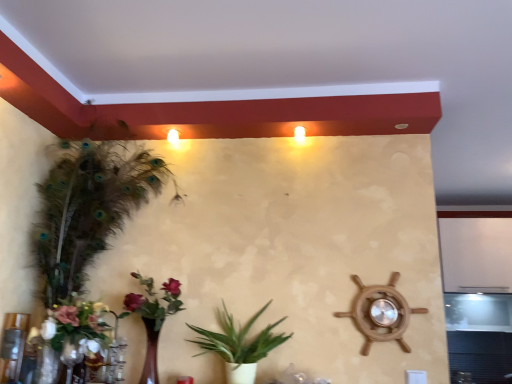
Question: Should I look upward or downward to see white matte floral arrangement at lower left, marked as the 2th floral arrangement in a right-to-left arrangement?

Choices:
 (A) down
 (B) up

Answer: (A)

Question: Should I look upward or downward to see matte wooden vase with flowers at lower left, the 2th floral arrangement in the left-to-right sequence?

Choices:
 (A) down
 (B) up

Answer: (A)

Question: Is white matte floral arrangement at lower left, marked as the 2th floral arrangement in a right-to-left arrangement, facing towards green feathered houseplant at left, which is counted as the 1th houseplant, starting from the left?

Choices:
 (A) no
 (B) yes

Answer: (B)

Question: Is white matte floral arrangement at lower left, the first floral arrangement viewed from the left, taller than green feathered houseplant at left, which is counted as the 1th houseplant, starting from the left?

Choices:
 (A) no
 (B) yes

Answer: (A)

Question: Can you confirm if white matte floral arrangement at lower left, the first floral arrangement viewed from the left, is shorter than green feathered houseplant at left, which is counted as the 1th houseplant, starting from the left?

Choices:
 (A) no
 (B) yes

Answer: (B)

Question: Is white matte floral arrangement at lower left, marked as the 2th floral arrangement in a right-to-left arrangement, not within green feathered houseplant at left, which is counted as the 1th houseplant, starting from the left?

Choices:
 (A) no
 (B) yes

Answer: (A)

Question: Does white matte floral arrangement at lower left, the first floral arrangement viewed from the left, contain green feathered houseplant at left, which is counted as the 1th houseplant, starting from the left?

Choices:
 (A) yes
 (B) no

Answer: (B)

Question: Is white matte floral arrangement at lower left, the first floral arrangement viewed from the left, placed right next to green feathered houseplant at left, arranged as the second houseplant when viewed from the right?

Choices:
 (A) no
 (B) yes

Answer: (A)

Question: Is matte wooden vase with flowers at lower left, the 2th floral arrangement in the left-to-right sequence, not near green leafy plant at center, positioned as the 2th houseplant in left-to-right order?

Choices:
 (A) yes
 (B) no

Answer: (B)

Question: From the image's perspective, does matte wooden vase with flowers at lower left, the 2th floral arrangement in the left-to-right sequence, appear lower than green leafy plant at center, the 1th houseplant viewed from the right?

Choices:
 (A) no
 (B) yes

Answer: (A)

Question: Considering the relative sizes of matte wooden vase with flowers at lower left, the 2th floral arrangement in the left-to-right sequence, and green leafy plant at center, positioned as the 2th houseplant in left-to-right order, in the image provided, is matte wooden vase with flowers at lower left, the 2th floral arrangement in the left-to-right sequence, thinner than green leafy plant at center, positioned as the 2th houseplant in left-to-right order,?

Choices:
 (A) yes
 (B) no

Answer: (B)

Question: From a real-world perspective, is matte wooden vase with flowers at lower left, which ranks as the 1th floral arrangement in right-to-left order, physically above green leafy plant at center, the 1th houseplant viewed from the right?

Choices:
 (A) yes
 (B) no

Answer: (A)

Question: Does matte wooden vase with flowers at lower left, which ranks as the 1th floral arrangement in right-to-left order, appear on the left side of green leafy plant at center, the 1th houseplant viewed from the right?

Choices:
 (A) no
 (B) yes

Answer: (B)

Question: Can you confirm if matte wooden vase with flowers at lower left, which ranks as the 1th floral arrangement in right-to-left order, is smaller than green leafy plant at center, the 1th houseplant viewed from the right?

Choices:
 (A) no
 (B) yes

Answer: (B)

Question: From a real-world perspective, is matte wooden vase with flowers at lower left, the 2th floral arrangement in the left-to-right sequence, located higher than white matte floral arrangement at lower left, marked as the 2th floral arrangement in a right-to-left arrangement?

Choices:
 (A) yes
 (B) no

Answer: (A)